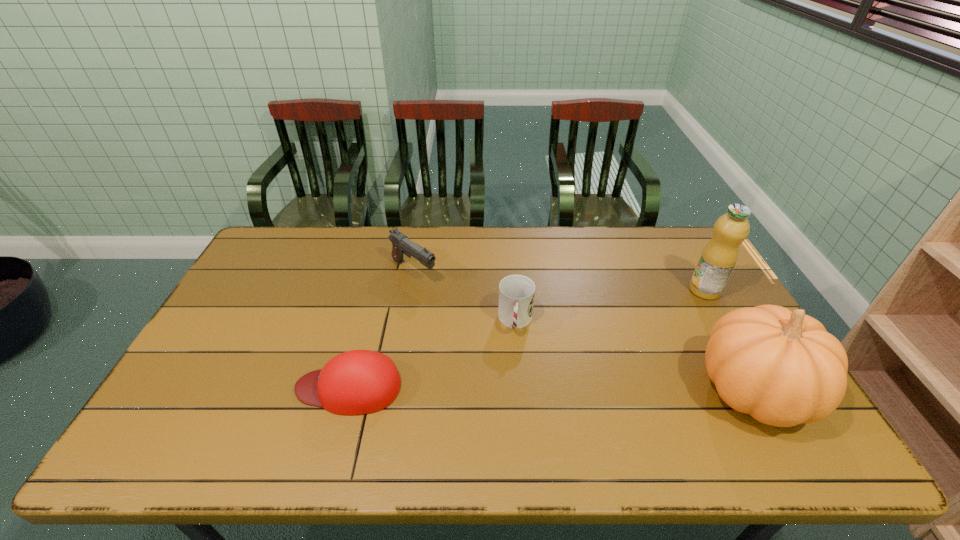
In order to click on unoccupied area between the pumpkin and the gun in this screenshot , I will do `click(585, 330)`.

Where is `free spot between the pumpkin and the baseball cap`? The width and height of the screenshot is (960, 540). free spot between the pumpkin and the baseball cap is located at coordinates (552, 388).

Where is `vacant area that lies between the third object from left to right and the pumpkin`? vacant area that lies between the third object from left to right and the pumpkin is located at coordinates (636, 355).

Identify the location of empty location between the pumpkin and the gun. tap(585, 330).

What are the coordinates of `empty location between the pumpkin and the gun` in the screenshot? It's located at pyautogui.click(x=585, y=330).

Find the location of a particular element. The height and width of the screenshot is (540, 960). vacant area between the fruit juice and the baseball cap is located at coordinates (527, 339).

The width and height of the screenshot is (960, 540). In order to click on free space between the third farthest object and the fruit juice in this screenshot , I will do `click(611, 306)`.

You are a GUI agent. You are given a task and a screenshot of the screen. Output one action in this format:
    pyautogui.click(x=<x>, y=<y>)
    Task: Click on the vacant space that's between the baseball cap and the cup
    The width and height of the screenshot is (960, 540).
    Given the screenshot: What is the action you would take?
    pyautogui.click(x=432, y=354)

The image size is (960, 540). I want to click on object identified as the closest to the baseball cap, so click(516, 292).

This screenshot has height=540, width=960. I want to click on object that stands as the fourth closest to the baseball cap, so click(718, 259).